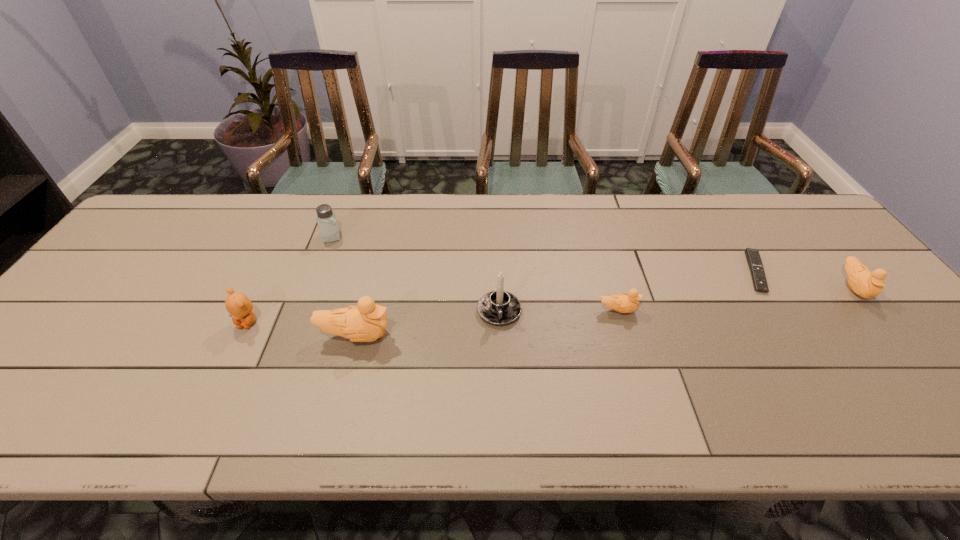
At what (x,y) coordinates should I click in order to perform the action: click on object at the right edge. Please return your answer as a coordinate pair (x, y). The width and height of the screenshot is (960, 540). Looking at the image, I should click on (867, 284).

Where is `free space at the far edge of the desktop`? free space at the far edge of the desktop is located at coordinates (669, 232).

Where is `vacant space at the near edge`? Image resolution: width=960 pixels, height=540 pixels. vacant space at the near edge is located at coordinates (524, 364).

I want to click on free space at the left edge of the desktop, so click(x=142, y=282).

You are a GUI agent. You are given a task and a screenshot of the screen. Output one action in this format:
    pyautogui.click(x=<x>, y=<y>)
    Task: Click on the vacant space at the right edge of the desktop
    
    Given the screenshot: What is the action you would take?
    pyautogui.click(x=883, y=329)

Locate an element on the screen. free space at the far left corner of the desktop is located at coordinates [190, 224].

Find the location of a particular element. vacant space in between the teddy bear and the second object from left to right is located at coordinates (290, 279).

Locate an element on the screen. free space between the sixth object from right to left and the teddy bear is located at coordinates (290, 279).

Where is `free space between the leftmost duckling and the shortest object`? The width and height of the screenshot is (960, 540). free space between the leftmost duckling and the shortest object is located at coordinates (556, 303).

The height and width of the screenshot is (540, 960). Find the location of `empty space between the teddy bear and the farthest object`. empty space between the teddy bear and the farthest object is located at coordinates click(290, 279).